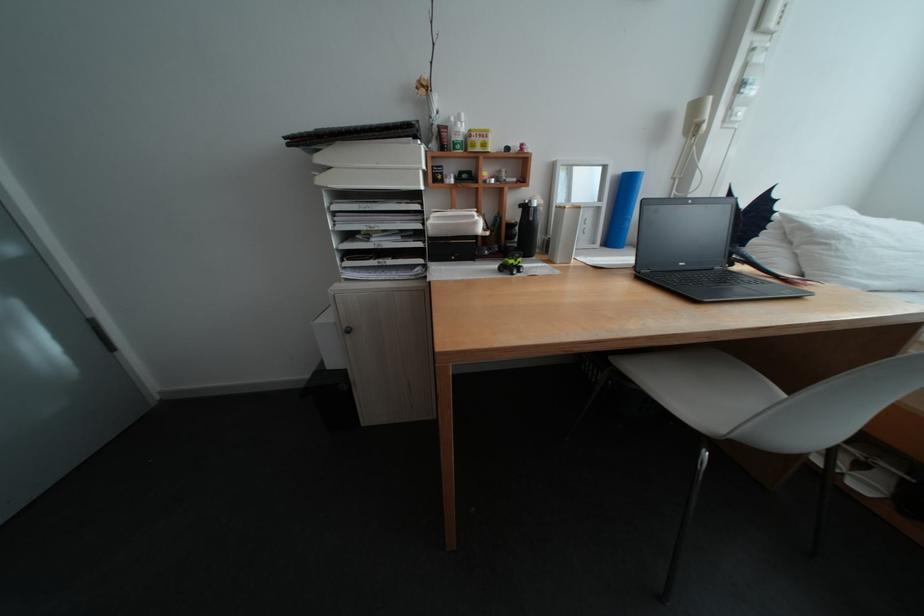
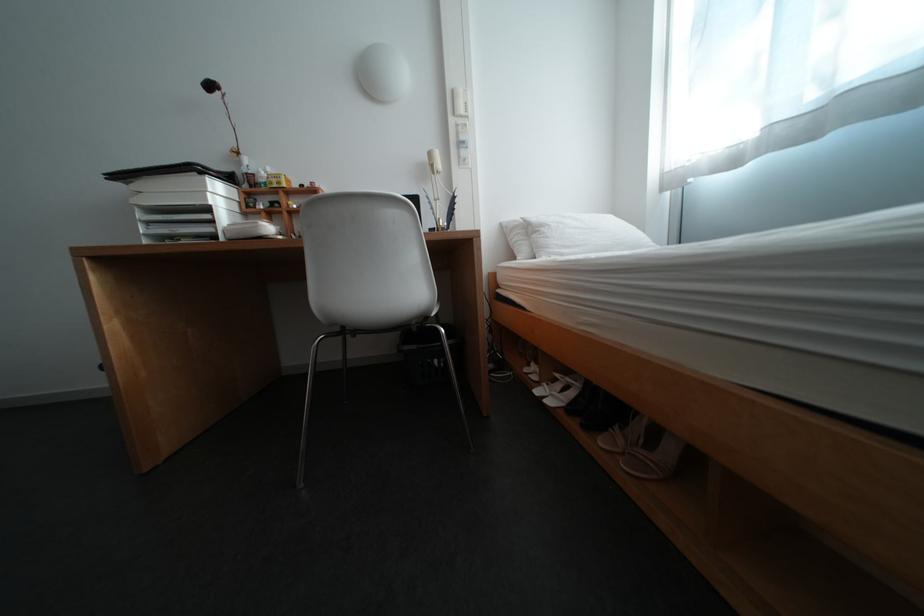
The point at (849, 240) is marked in the first image. Where is the corresponding point in the second image?

(555, 228)